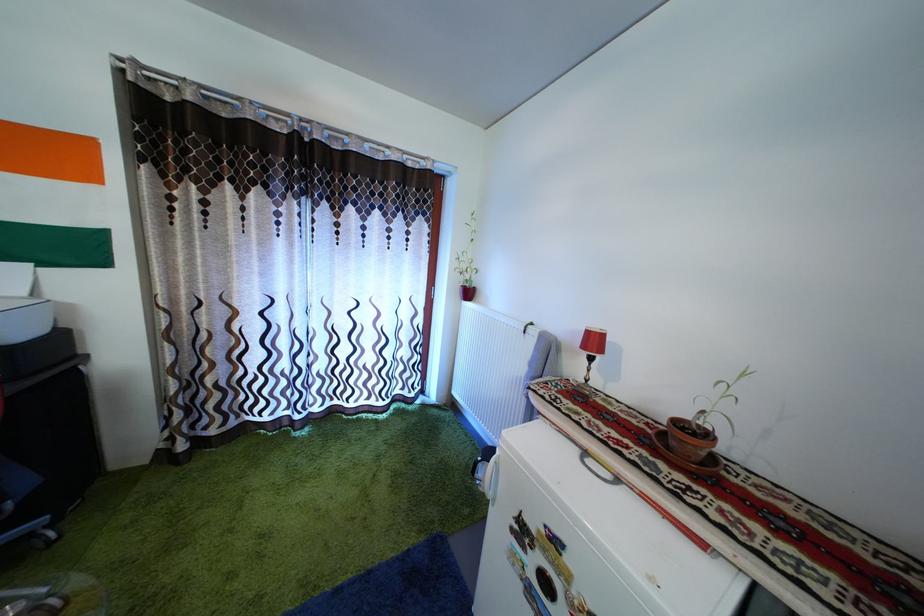
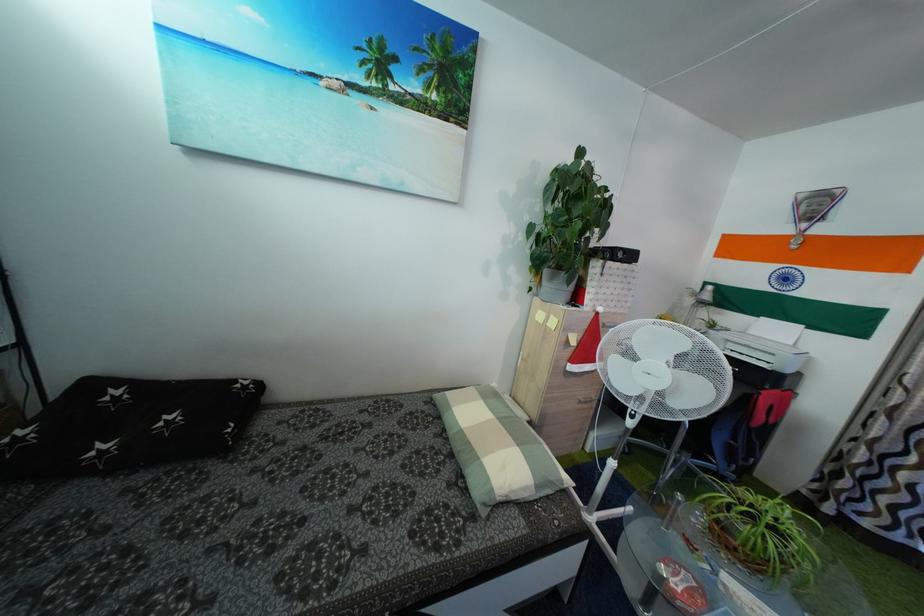
Question: The images are taken continuously from a first-person perspective. In which direction is your viewpoint rotating?

Choices:
 (A) Left
 (B) Right
 (C) Up
 (D) Down

Answer: (A)